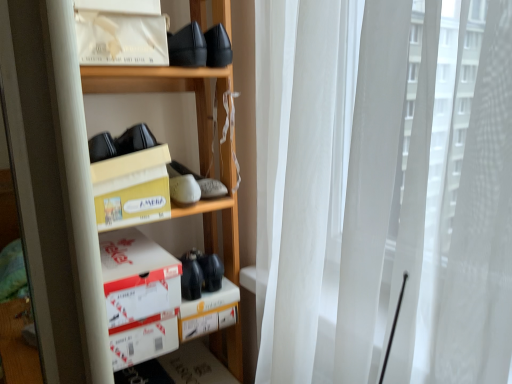
At what (x,y) coordinates should I click in order to perform the action: click on yellow cardboard shoebox at center. Please return your answer as a coordinate pair (x, y). Looking at the image, I should click on (163, 90).

The width and height of the screenshot is (512, 384). What do you see at coordinates (163, 90) in the screenshot?
I see `yellow cardboard shoebox at center` at bounding box center [163, 90].

The image size is (512, 384). Identify the location of yellow cardboard shoebox at center. (163, 90).